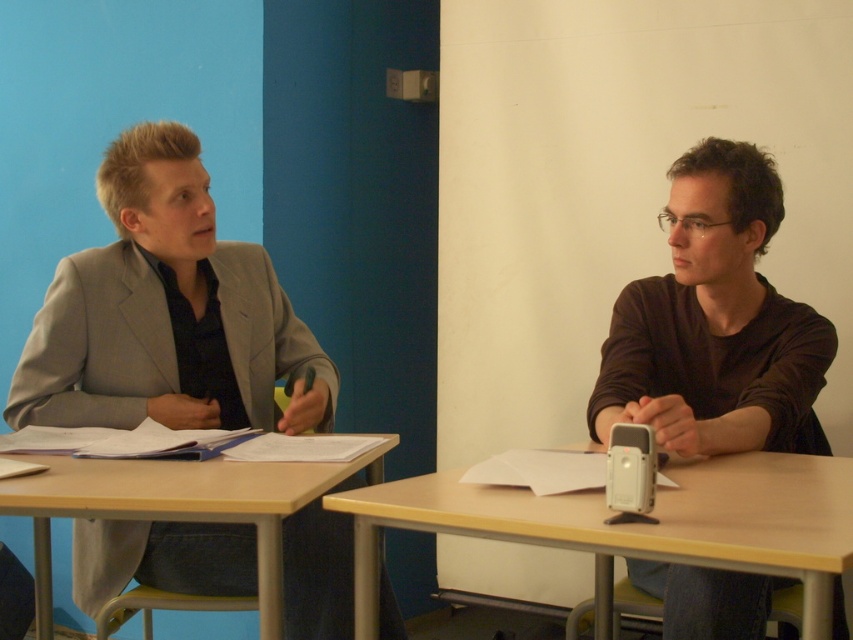
Question: Which object appears closest to the camera in this image?

Choices:
 (A) matte brown shirt at right
 (B) light wood table at center
 (C) light brown wood table at lower left
 (D) matte gray blazer at left

Answer: (B)

Question: Is light wood table at center bigger than light brown wood table at lower left?

Choices:
 (A) yes
 (B) no

Answer: (B)

Question: Among these objects, which one is nearest to the camera?

Choices:
 (A) light brown wood table at lower left
 (B) matte brown shirt at right

Answer: (A)

Question: Does matte brown shirt at right appear over light wood table at center?

Choices:
 (A) no
 (B) yes

Answer: (B)

Question: Which object is the closest to the matte brown shirt at right?

Choices:
 (A) light wood table at center
 (B) light brown wood table at lower left
 (C) matte gray blazer at left

Answer: (A)

Question: Can you confirm if matte brown shirt at right is positioned to the right of light brown wood table at lower left?

Choices:
 (A) no
 (B) yes

Answer: (B)